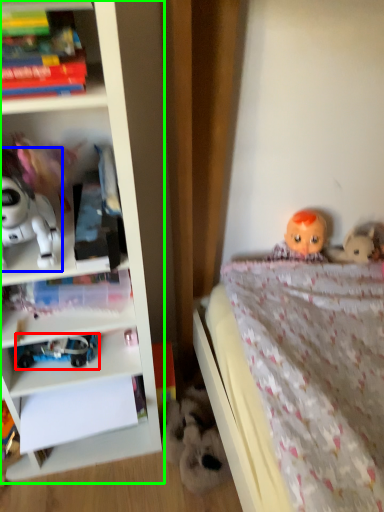
Question: Which object is positioned closest to toy (highlighted by a red box)? Select from toy (highlighted by a blue box) and bookcase (highlighted by a green box).

Choices:
 (A) toy
 (B) bookcase

Answer: (B)